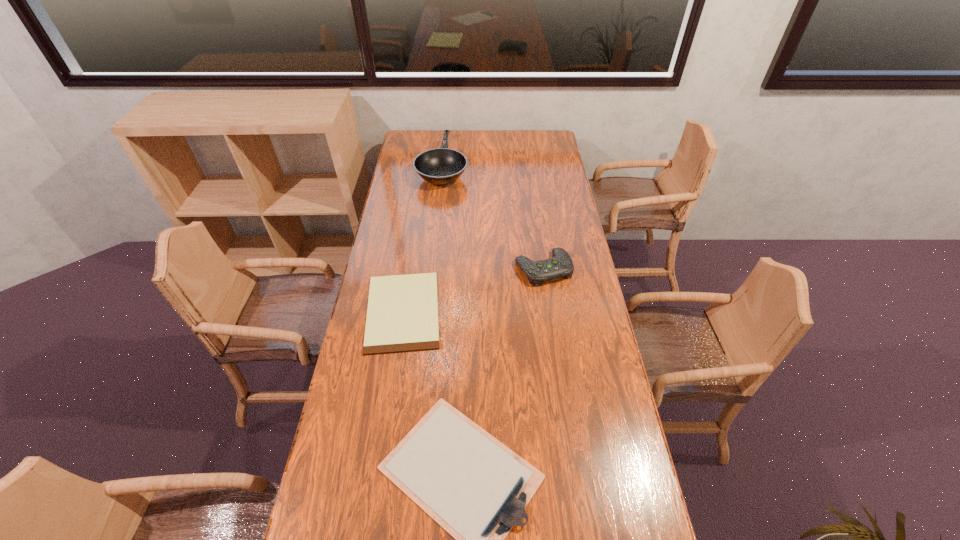
Where is `clipboard that is positioned at the left edge`? clipboard that is positioned at the left edge is located at coordinates (402, 316).

Locate an element on the screen. object that is positioned at the right edge is located at coordinates (561, 265).

Where is `object that is at the far left corner`? object that is at the far left corner is located at coordinates (440, 166).

Find the location of a particular element. vacant space at the far edge of the desktop is located at coordinates (455, 138).

You are a GUI agent. You are given a task and a screenshot of the screen. Output one action in this format:
    pyautogui.click(x=<x>, y=<y>)
    Task: Click on the vacant area at the left edge
    
    Given the screenshot: What is the action you would take?
    pyautogui.click(x=395, y=359)

I want to click on blank space at the right edge, so click(x=562, y=206).

The width and height of the screenshot is (960, 540). I want to click on free space at the far right corner of the desktop, so click(536, 139).

At what (x,y) coordinates should I click in order to perform the action: click on unoccupied position between the control and the shortest object. Please return your answer as a coordinate pair (x, y). This screenshot has width=960, height=540. Looking at the image, I should click on (473, 290).

The height and width of the screenshot is (540, 960). I want to click on empty location between the shortest object and the control, so click(473, 290).

Where is `vacant area that lies between the second tallest object and the farther clipboard`? This screenshot has width=960, height=540. vacant area that lies between the second tallest object and the farther clipboard is located at coordinates (473, 290).